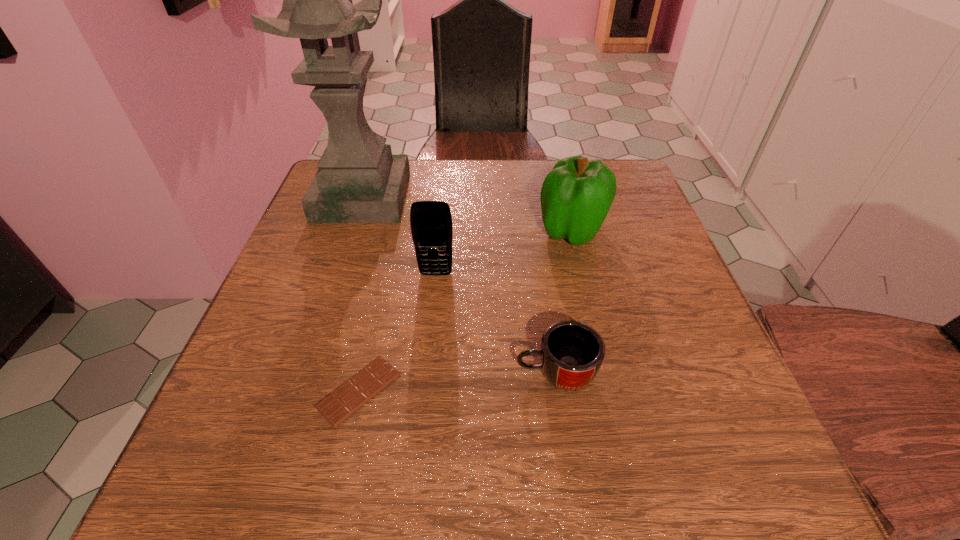
Locate an element on the screen. The width and height of the screenshot is (960, 540). the tallest object is located at coordinates (358, 180).

Locate an element on the screen. bell pepper is located at coordinates (576, 196).

What are the coordinates of `the third object from right to left` in the screenshot? It's located at pyautogui.click(x=431, y=222).

Where is `the third nearest object`? The width and height of the screenshot is (960, 540). the third nearest object is located at coordinates (431, 222).

Locate an element on the screen. mug is located at coordinates (571, 353).

This screenshot has height=540, width=960. Find the location of `the shortest object`. the shortest object is located at coordinates (336, 407).

The width and height of the screenshot is (960, 540). Identify the location of vacant space located 0.270m at the front opening of the sculpture. 516,197.

The height and width of the screenshot is (540, 960). Identify the location of vacant space located on the left of the bell pepper. (483, 230).

The height and width of the screenshot is (540, 960). Identify the location of free space located on the screen of the third nearest object. point(425,375).

The height and width of the screenshot is (540, 960). Find the location of `blank area located 0.270m on the side of the mug with the handle`. blank area located 0.270m on the side of the mug with the handle is located at coordinates (349, 374).